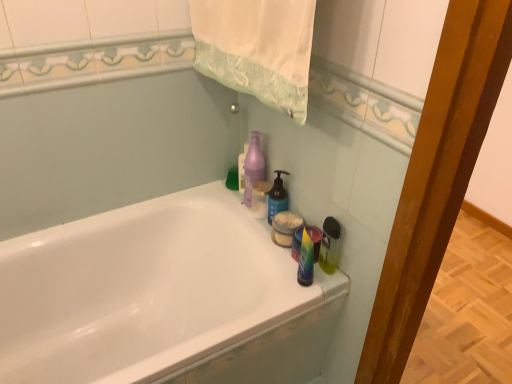
The image size is (512, 384). Find the location of `purple matte pump bottle at upper center, the third cleaning product from the right`. purple matte pump bottle at upper center, the third cleaning product from the right is located at coordinates (253, 167).

Describe the element at coordinates (329, 245) in the screenshot. The height and width of the screenshot is (384, 512). I see `translucent plastic spray bottle at right, arranged as the fourth cleaning product when viewed from the left` at that location.

This screenshot has height=384, width=512. What do you see at coordinates (277, 197) in the screenshot?
I see `blue matte bottle at upper right, placed as the third cleaning product when sorted from left to right` at bounding box center [277, 197].

The height and width of the screenshot is (384, 512). I want to click on white fabric towel at upper center, so click(257, 48).

Identify the location of white glossy bathtub at upper center. The image size is (512, 384). (162, 298).

Is purple matte pump bottle at upper center, the third cleaning product from the right, next to translucent plastic spray bottle at right, the first cleaning product in the right-to-left sequence?

purple matte pump bottle at upper center, the third cleaning product from the right, and translucent plastic spray bottle at right, the first cleaning product in the right-to-left sequence, are not in contact.

Looking at their sizes, would you say purple matte pump bottle at upper center, the third cleaning product from the right, is wider or thinner than translucent plastic spray bottle at right, the first cleaning product in the right-to-left sequence?

purple matte pump bottle at upper center, the third cleaning product from the right, is wider than translucent plastic spray bottle at right, the first cleaning product in the right-to-left sequence.

Which of these two, purple matte pump bottle at upper center, the third cleaning product from the right, or translucent plastic spray bottle at right, the first cleaning product in the right-to-left sequence, is bigger?

Bigger between the two is purple matte pump bottle at upper center, the third cleaning product from the right.

How distant is purple matte pump bottle at upper center, the third cleaning product from the right, from translucent plastic spray bottle at right, the first cleaning product in the right-to-left sequence?

purple matte pump bottle at upper center, the third cleaning product from the right, is 37.09 centimeters from translucent plastic spray bottle at right, the first cleaning product in the right-to-left sequence.

Is purple matte pump bottle at upper center, which is counted as the second cleaning product, starting from the left, at the back of purple matte bottle at upper center, which appears as the fourth cleaning product when viewed from the right?

No.

Would you say purple matte bottle at upper center, which appears as the fourth cleaning product when viewed from the right, is a long distance from purple matte pump bottle at upper center, which is counted as the second cleaning product, starting from the left?

They are positioned close to each other.

Looking at their sizes, would you say purple matte bottle at upper center, positioned as the first cleaning product in left-to-right order, is wider or thinner than purple matte pump bottle at upper center, the third cleaning product from the right?

Clearly, purple matte bottle at upper center, positioned as the first cleaning product in left-to-right order, has less width compared to purple matte pump bottle at upper center, the third cleaning product from the right.

Consider the image. Does purple matte bottle at upper center, which appears as the fourth cleaning product when viewed from the right, appear on the left side of purple matte pump bottle at upper center, the third cleaning product from the right?

Yes, purple matte bottle at upper center, which appears as the fourth cleaning product when viewed from the right, is to the left of purple matte pump bottle at upper center, the third cleaning product from the right.

From a real-world perspective, is translucent plastic spray bottle at right, arranged as the fourth cleaning product when viewed from the left, located beneath white fabric towel at upper center?

Yes, from a real-world perspective, translucent plastic spray bottle at right, arranged as the fourth cleaning product when viewed from the left, is beneath white fabric towel at upper center.

Can you confirm if translucent plastic spray bottle at right, arranged as the fourth cleaning product when viewed from the left, is thinner than white fabric towel at upper center?

Yes.

Can white fabric towel at upper center be found inside translucent plastic spray bottle at right, the first cleaning product in the right-to-left sequence?

No, white fabric towel at upper center is not a part of translucent plastic spray bottle at right, the first cleaning product in the right-to-left sequence.

Is translucent plastic spray bottle at right, the first cleaning product in the right-to-left sequence, positioned in front of white fabric towel at upper center?

No, translucent plastic spray bottle at right, the first cleaning product in the right-to-left sequence, is further to the viewer.

Is point (328, 242) farther from viewer compared to point (3, 307)?

No, it is not.

Is translucent plastic spray bottle at right, arranged as the fourth cleaning product when viewed from the left, far away from white glossy bathtub at upper center?

That's not correct — translucent plastic spray bottle at right, arranged as the fourth cleaning product when viewed from the left, is a little close to white glossy bathtub at upper center.

Is translucent plastic spray bottle at right, arranged as the fourth cleaning product when viewed from the left, not inside white glossy bathtub at upper center?

That's correct, translucent plastic spray bottle at right, arranged as the fourth cleaning product when viewed from the left, is outside of white glossy bathtub at upper center.

Do you think purple matte bottle at upper center, positioned as the first cleaning product in left-to-right order, is within white fabric towel at upper center, or outside of it?

The correct answer is: outside.

In the scene shown: Which point is more distant from viewer, (244, 172) or (248, 11)?

The point (244, 172) is more distant.

Which is in front, point (310, 361) or point (244, 145)?

The point (310, 361) is in front.

Is white glossy bathtub at upper center positioned beyond the bounds of purple matte bottle at upper center, which appears as the fourth cleaning product when viewed from the right?

That's correct, white glossy bathtub at upper center is outside of purple matte bottle at upper center, which appears as the fourth cleaning product when viewed from the right.

Could you tell me if white glossy bathtub at upper center is facing purple matte bottle at upper center, which appears as the fourth cleaning product when viewed from the right?

No, white glossy bathtub at upper center is not aimed at purple matte bottle at upper center, which appears as the fourth cleaning product when viewed from the right.

Which of these two, white glossy bathtub at upper center or purple matte bottle at upper center, positioned as the first cleaning product in left-to-right order, is thinner?

With smaller width is purple matte bottle at upper center, positioned as the first cleaning product in left-to-right order.

Is purple matte bottle at upper center, which appears as the fourth cleaning product when viewed from the right, in front of or behind white glossy bathtub at upper center in the image?

In the image, purple matte bottle at upper center, which appears as the fourth cleaning product when viewed from the right, appears behind white glossy bathtub at upper center.

Does purple matte bottle at upper center, positioned as the first cleaning product in left-to-right order, have a greater width compared to white glossy bathtub at upper center?

No.

From the image's perspective, is purple matte bottle at upper center, positioned as the first cleaning product in left-to-right order, below white glossy bathtub at upper center?

No.

The width and height of the screenshot is (512, 384). I want to click on cleaning product that is the 2nd object located behind the translucent plastic spray bottle at right, arranged as the fourth cleaning product when viewed from the left, so click(253, 167).

What are the coordinates of `cleaning product above the purple matte bottle at upper center, which appears as the fourth cleaning product when viewed from the right (from a real-world perspective)` in the screenshot? It's located at (253, 167).

Based on their spatial positions, is white glossy bathtub at upper center or translucent plastic spray bottle at right, arranged as the fourth cleaning product when viewed from the left, further from white fabric towel at upper center?

white glossy bathtub at upper center lies further to white fabric towel at upper center than the other object.

Looking at this image, looking at the image, which one is located closer to purple matte bottle at upper center, which appears as the fourth cleaning product when viewed from the right, white glossy bathtub at upper center or white fabric towel at upper center?

white fabric towel at upper center is positioned closer to the anchor purple matte bottle at upper center, which appears as the fourth cleaning product when viewed from the right.

Based on their spatial positions, is purple matte pump bottle at upper center, which is counted as the second cleaning product, starting from the left, or blue matte bottle at upper right, placed as the third cleaning product when sorted from left to right, closer to white fabric towel at upper center?

Based on the image, purple matte pump bottle at upper center, which is counted as the second cleaning product, starting from the left, appears to be nearer to white fabric towel at upper center.

From the image, which object appears to be nearer to purple matte bottle at upper center, which appears as the fourth cleaning product when viewed from the right, white glossy bathtub at upper center or purple matte pump bottle at upper center, the third cleaning product from the right?

purple matte pump bottle at upper center, the third cleaning product from the right, is closer to purple matte bottle at upper center, which appears as the fourth cleaning product when viewed from the right.

When comparing their distances from white fabric towel at upper center, does purple matte bottle at upper center, positioned as the first cleaning product in left-to-right order, or blue matte bottle at upper right, arranged as the second cleaning product when viewed from the right, seem closer?

purple matte bottle at upper center, positioned as the first cleaning product in left-to-right order, is closer to white fabric towel at upper center.

Looking at the image, which one is located further to white glossy bathtub at upper center, blue matte bottle at upper right, arranged as the second cleaning product when viewed from the right, or white fabric towel at upper center?

white fabric towel at upper center.

Which object lies further to the anchor point purple matte pump bottle at upper center, which is counted as the second cleaning product, starting from the left, purple matte bottle at upper center, positioned as the first cleaning product in left-to-right order, or white fabric towel at upper center?

The object further to purple matte pump bottle at upper center, which is counted as the second cleaning product, starting from the left, is white fabric towel at upper center.

Looking at the image, which one is located further to white glossy bathtub at upper center, purple matte pump bottle at upper center, which is counted as the second cleaning product, starting from the left, or white fabric towel at upper center?

white fabric towel at upper center is positioned further to the anchor white glossy bathtub at upper center.

You are a GUI agent. You are given a task and a screenshot of the screen. Output one action in this format:
    pyautogui.click(x=<x>, y=<y>)
    Task: Click on the cleaning product located between blue matte bottle at upper right, placed as the third cleaning product when sorted from left to right, and purple matte bottle at upper center, which appears as the fourth cleaning product when viewed from the right, in the depth direction
    The width and height of the screenshot is (512, 384).
    Given the screenshot: What is the action you would take?
    pyautogui.click(x=253, y=167)

This screenshot has height=384, width=512. I want to click on cleaning product between purple matte pump bottle at upper center, the third cleaning product from the right, and translucent plastic spray bottle at right, the first cleaning product in the right-to-left sequence, in the vertical direction, so click(277, 197).